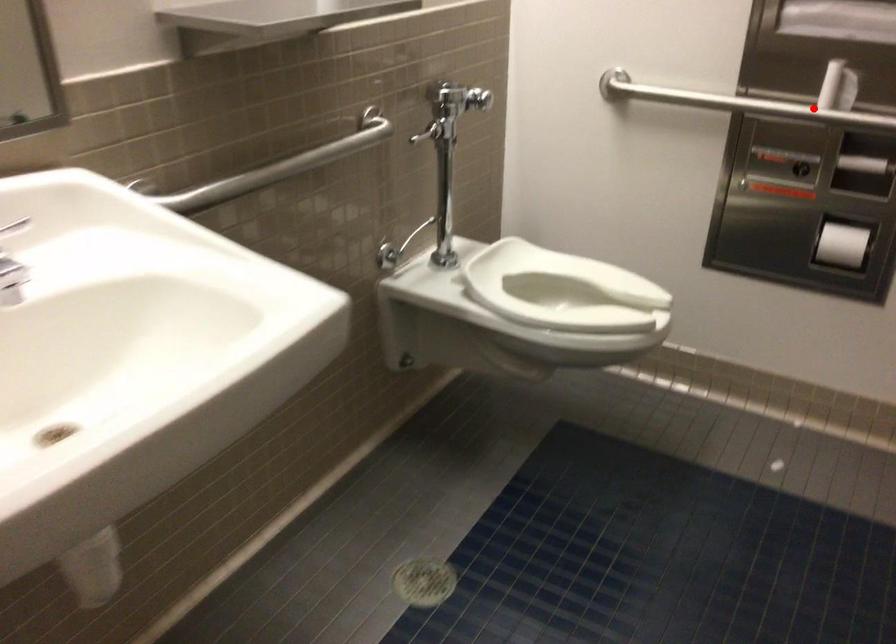
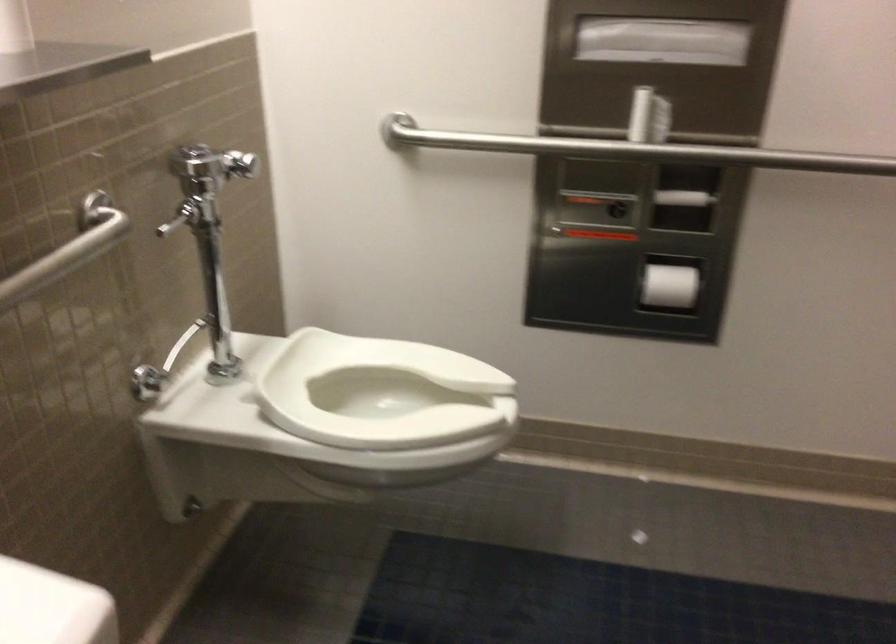
In the second image, find the point that corresponds to the highlighted location in the first image.

(630, 149)